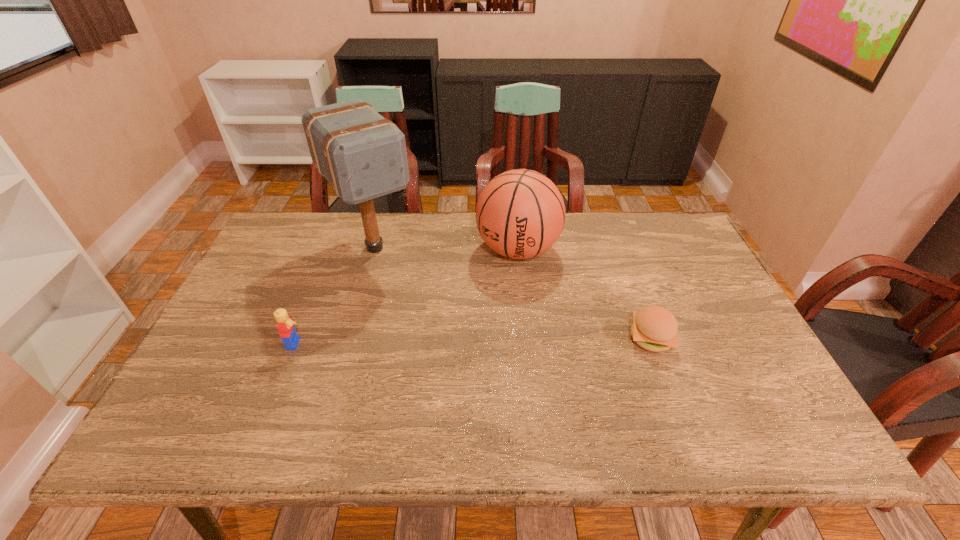
Locate an element on the screen. free spot on the desktop that is between the Lego and the rightmost object and is positioned on the surface of the basketball near the brand logo is located at coordinates (468, 341).

The width and height of the screenshot is (960, 540). Identify the location of free spot on the desktop that is between the Lego and the rightmost object and is positioned on the striking surface of the mallet. (448, 341).